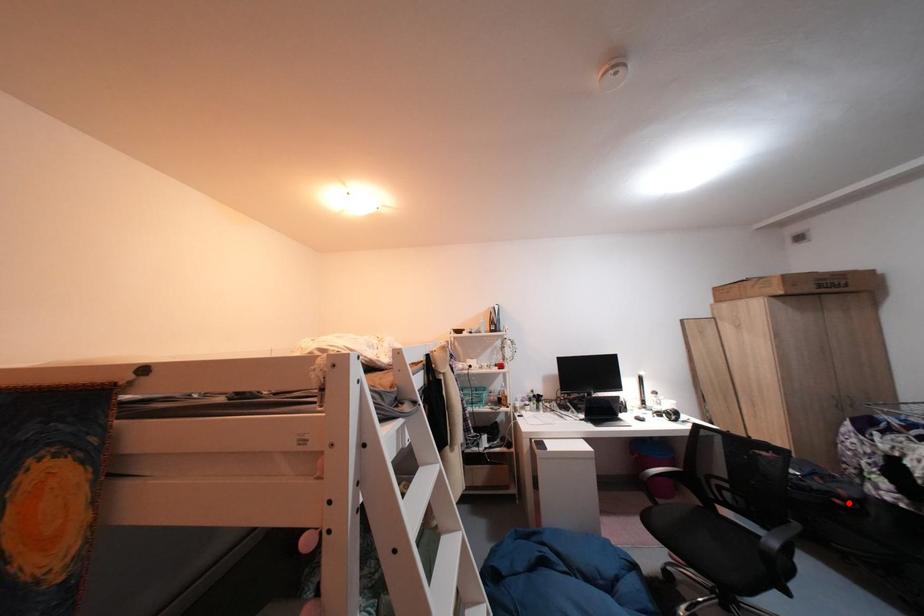
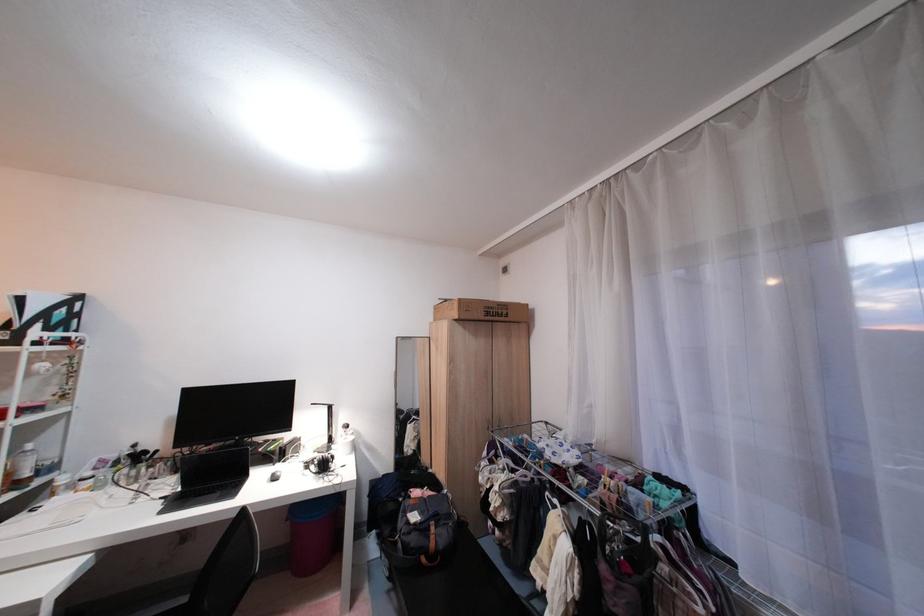
Locate, in the second image, the point that corresponds to the highlighted location in the first image.

(434, 561)